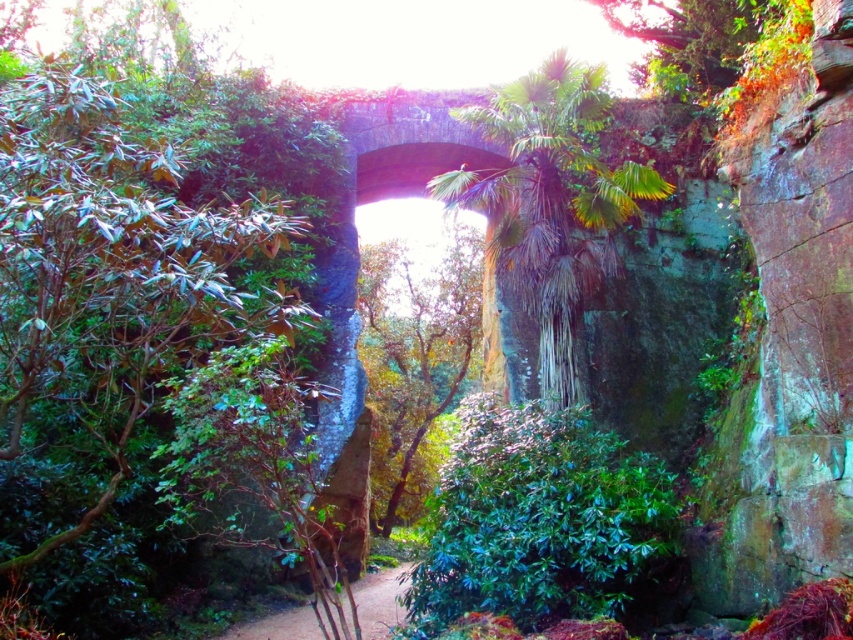
Question: Which point is closer to the camera?

Choices:
 (A) green leafy tree at upper center
 (B) brown dirt path at center

Answer: (A)

Question: Can you confirm if green leafy bush at left is thinner than green glossy bush at center?

Choices:
 (A) yes
 (B) no

Answer: (B)

Question: Does green glossy bush at center have a smaller size compared to green leafy tree at upper center?

Choices:
 (A) yes
 (B) no

Answer: (A)

Question: Which point is farther to the camera?

Choices:
 (A) (198, 248)
 (B) (506, 102)
 (C) (387, 605)

Answer: (B)

Question: Estimate the real-world distances between objects in this image. Which object is closer to the green leafy tree at upper center?

Choices:
 (A) green leafy palm at center
 (B) green leafy tree at center

Answer: (A)

Question: Considering the relative positions of green glossy bush at center and green leafy tree at center in the image provided, where is green glossy bush at center located with respect to green leafy tree at center?

Choices:
 (A) left
 (B) right

Answer: (B)